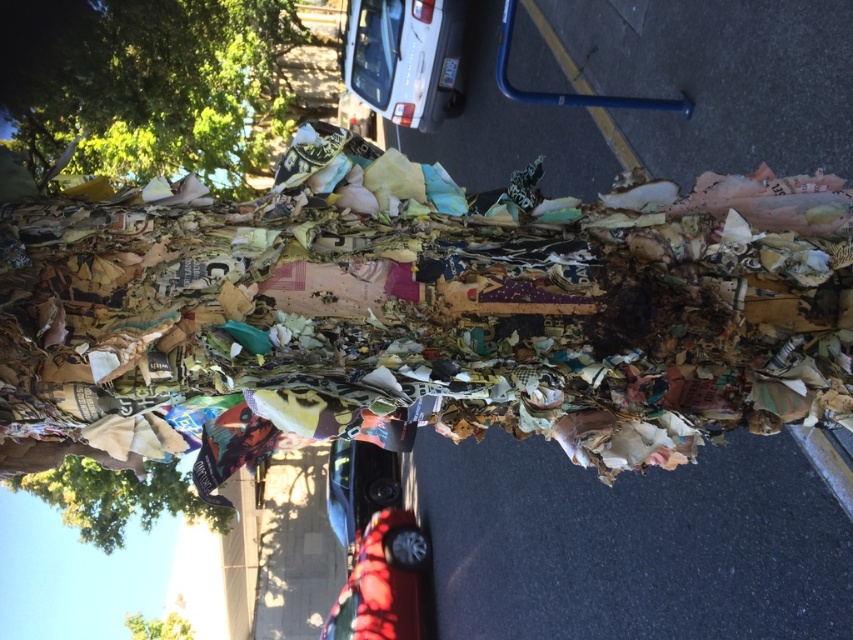
Does shiny black car at center come in front of yellow paper tree at lower left?

Yes, it is.

Does shiny black car at center appear on the right side of yellow paper tree at lower left?

Correct, you'll find shiny black car at center to the right of yellow paper tree at lower left.

The width and height of the screenshot is (853, 640). What do you see at coordinates (358, 486) in the screenshot?
I see `shiny black car at center` at bounding box center [358, 486].

You are a GUI agent. You are given a task and a screenshot of the screen. Output one action in this format:
    pyautogui.click(x=<x>, y=<y>)
    Task: Click on the shiny black car at center
    The image size is (853, 640).
    Given the screenshot: What is the action you would take?
    coord(358,486)

Does green leafy tree at upper left have a lesser width compared to shiny black car at center?

No.

Is green leafy tree at upper left positioned behind shiny black car at center?

No, green leafy tree at upper left is in front of shiny black car at center.

Who is more distant from viewer, (47, 154) or (346, 461)?

Point (346, 461)

Find the location of a particular element. This screenshot has width=853, height=640. green leafy tree at upper left is located at coordinates (161, 88).

Does white matte car at upper center lie behind brown paper tree at lower left?

No, it is in front of brown paper tree at lower left.

Does point (460, 28) lie in front of point (152, 509)?

Yes, it is in front of point (152, 509).

Locate an element on the screen. The height and width of the screenshot is (640, 853). white matte car at upper center is located at coordinates (405, 58).